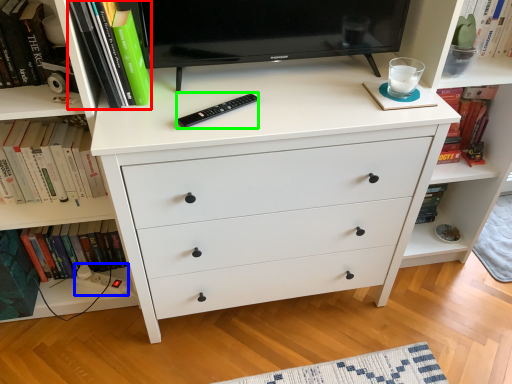
Question: Which object is positioned closest to book (highlighted by a red box)? Select from plug (highlighted by a blue box) and remote (highlighted by a green box).

Choices:
 (A) plug
 (B) remote

Answer: (B)